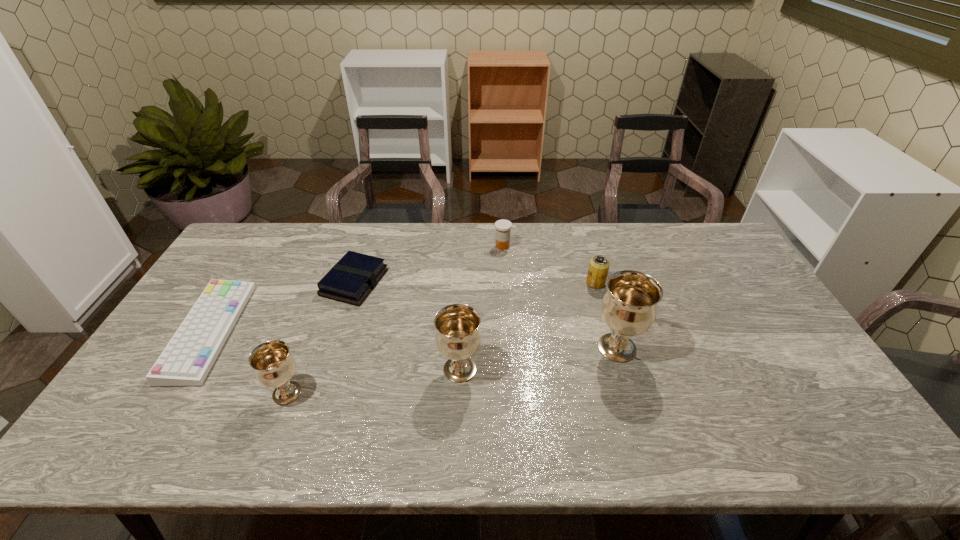
Identify the location of book located in the far edge section of the desktop. This screenshot has width=960, height=540. (351, 280).

This screenshot has width=960, height=540. In order to click on medicine that is positioned at the far edge in this screenshot , I will do pyautogui.click(x=503, y=227).

Where is `computer keyboard at the near edge`? computer keyboard at the near edge is located at coordinates (187, 359).

Where is `object present at the left edge`? The height and width of the screenshot is (540, 960). object present at the left edge is located at coordinates (187, 359).

You are a GUI agent. You are given a task and a screenshot of the screen. Output one action in this format:
    pyautogui.click(x=<x>, y=<y>)
    Task: Click on the object positioned at the near left corner
    The height and width of the screenshot is (540, 960).
    Given the screenshot: What is the action you would take?
    pyautogui.click(x=187, y=359)

The height and width of the screenshot is (540, 960). I want to click on vacant region at the far edge, so click(394, 231).

Image resolution: width=960 pixels, height=540 pixels. In the image, there is a desktop. What are the coordinates of `vacant region at the left edge` in the screenshot? It's located at (188, 307).

Locate an element on the screen. free point at the right edge is located at coordinates (750, 319).

The height and width of the screenshot is (540, 960). Identify the location of free region at the far left corner. (231, 264).

Locate an element on the screen. vacant space at the far right corner of the desktop is located at coordinates (686, 242).